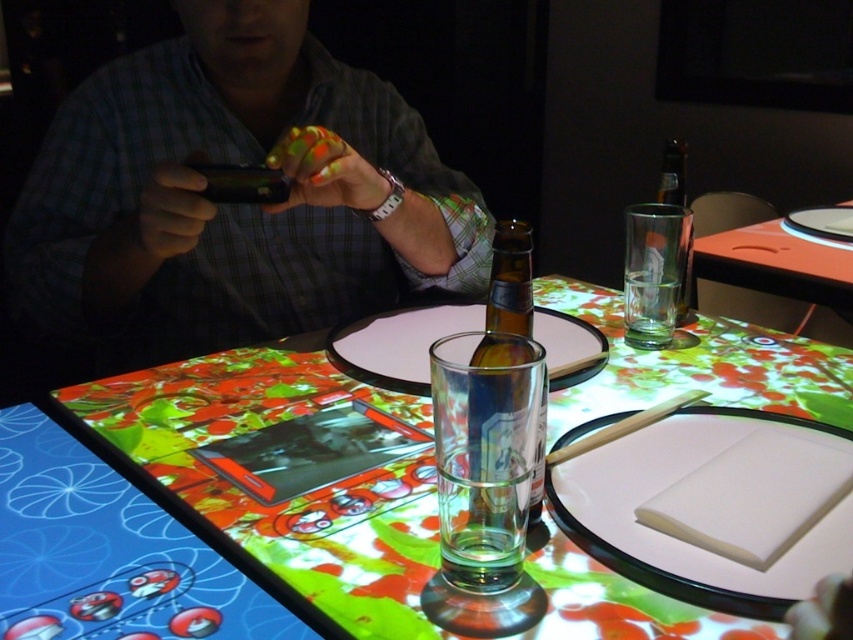
Is matte black phone at upper left positioned before clear glass at center?

No, it is behind clear glass at center.

In order to click on matte black phone at upper left in this screenshot , I will do `click(231, 204)`.

The height and width of the screenshot is (640, 853). What do you see at coordinates (293, 499) in the screenshot? I see `translucent glass beer bottle at center` at bounding box center [293, 499].

Can you confirm if translucent glass beer bottle at center is shorter than clear glass at center?

In fact, translucent glass beer bottle at center may be taller than clear glass at center.

Describe the element at coordinates (293, 499) in the screenshot. I see `translucent glass beer bottle at center` at that location.

Image resolution: width=853 pixels, height=640 pixels. Find the location of `translucent glass beer bottle at center`. translucent glass beer bottle at center is located at coordinates (293, 499).

Between clear glass at center and brown glass bottle at center, which one is positioned lower?

Positioned lower is clear glass at center.

Who is more distant from viewer, (532, 440) or (520, 257)?

Point (520, 257)

Identify the location of clear glass at center. (485, 452).